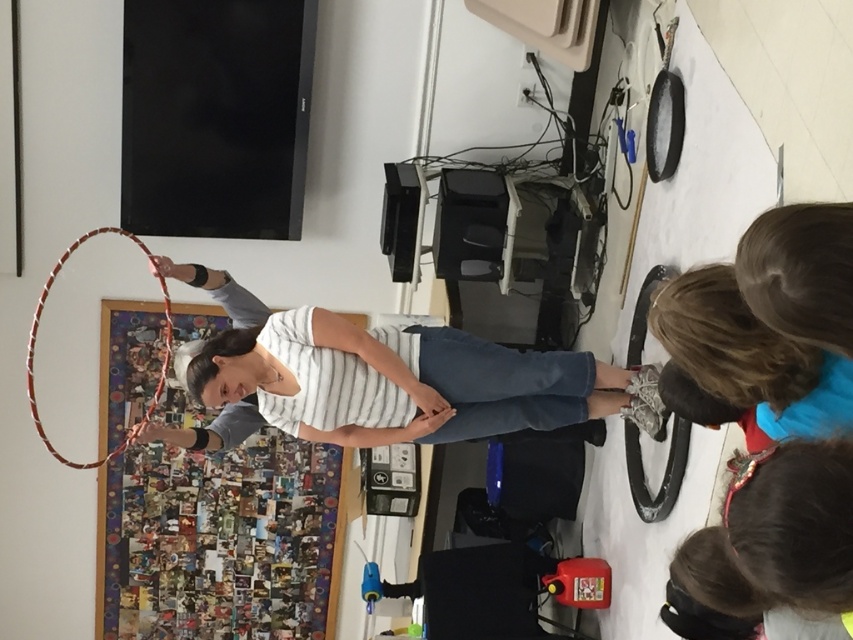
Who is more distant from viewer, (740,548) or (49,278)?

The point (49,278) is behind.

Does smooth brown hair at lower right have a smaller size compared to multicolored woven hoop at center?

Yes.

Is point (706, 588) positioned in front of point (76, 241)?

Yes, it is in front of point (76, 241).

Identify the location of smooth brown hair at lower right. The height and width of the screenshot is (640, 853). (776, 536).

Does white striped shirt at center come in front of smooth brown hair at lower right?

That is False.

Consider the image. Who is positioned more to the right, white striped shirt at center or smooth brown hair at lower right?

smooth brown hair at lower right

Which is in front, point (492, 397) or point (788, 458)?

Positioned in front is point (788, 458).

Find the location of `white striped shirt at center`. white striped shirt at center is located at coordinates (463, 385).

How much distance is there between white striped shirt at center and multicolored woven hoop at center?

white striped shirt at center is 1.56 meters from multicolored woven hoop at center.

Does white striped shirt at center appear under multicolored woven hoop at center?

Yes.

Who is more forward, (618,410) or (32,349)?

Point (618,410)

In order to click on white striped shirt at center in this screenshot , I will do `click(463, 385)`.